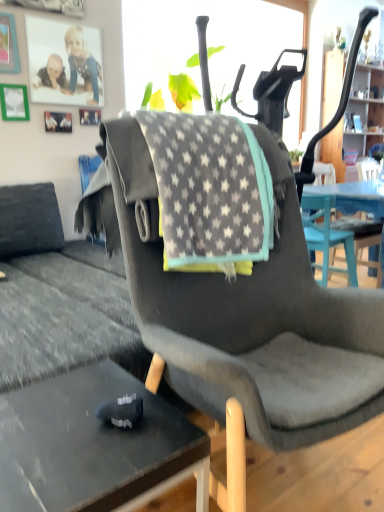
Question: Is point (82, 429) positioned closer to the camera than point (183, 180)?

Choices:
 (A) closer
 (B) farther

Answer: (A)

Question: Considering the positions of black glass desk at lower left and gray star-patterned fabric at center in the image, is black glass desk at lower left bigger or smaller than gray star-patterned fabric at center?

Choices:
 (A) big
 (B) small

Answer: (B)

Question: Estimate the real-world distances between objects in this image. Which object is closer to the wooden cabinet at upper right?

Choices:
 (A) gray star-patterned fabric at center
 (B) black glass desk at lower left
 (C) dark gray fabric chair at center

Answer: (A)

Question: Which is nearer to the black glass desk at lower left?

Choices:
 (A) dark gray fabric chair at center
 (B) gray star-patterned fabric at center
 (C) wooden cabinet at upper right

Answer: (A)